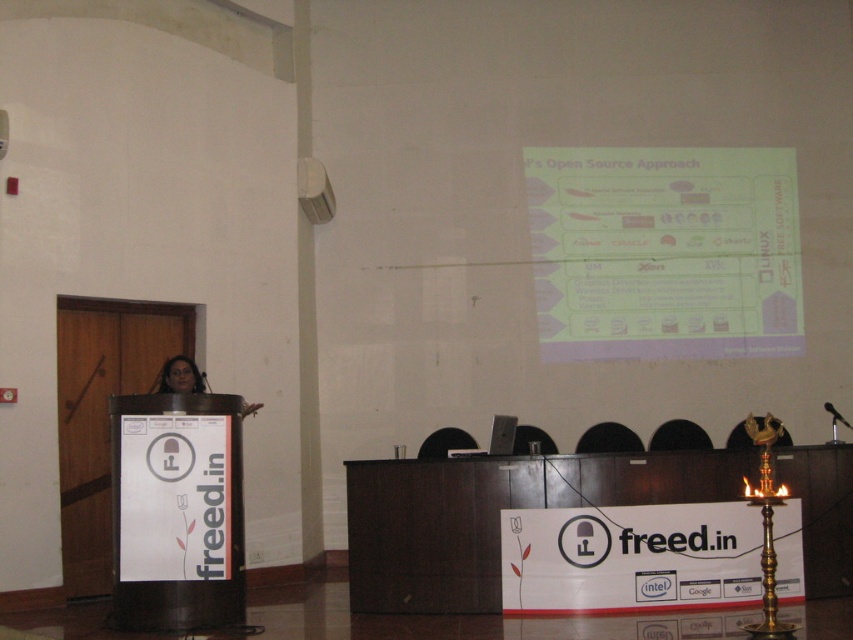
Question: Is white paper at upper center positioned behind matte black woman at center?

Choices:
 (A) yes
 (B) no

Answer: (A)

Question: Which of the following is the farthest from the observer?

Choices:
 (A) matte black woman at center
 (B) white paper at upper center

Answer: (B)

Question: Is white paper at upper center smaller than matte black woman at center?

Choices:
 (A) yes
 (B) no

Answer: (B)

Question: Which object appears closest to the camera in this image?

Choices:
 (A) white paper at upper center
 (B) matte black woman at center

Answer: (B)

Question: In this image, where is white paper at upper center located relative to matte black woman at center?

Choices:
 (A) right
 (B) left

Answer: (A)